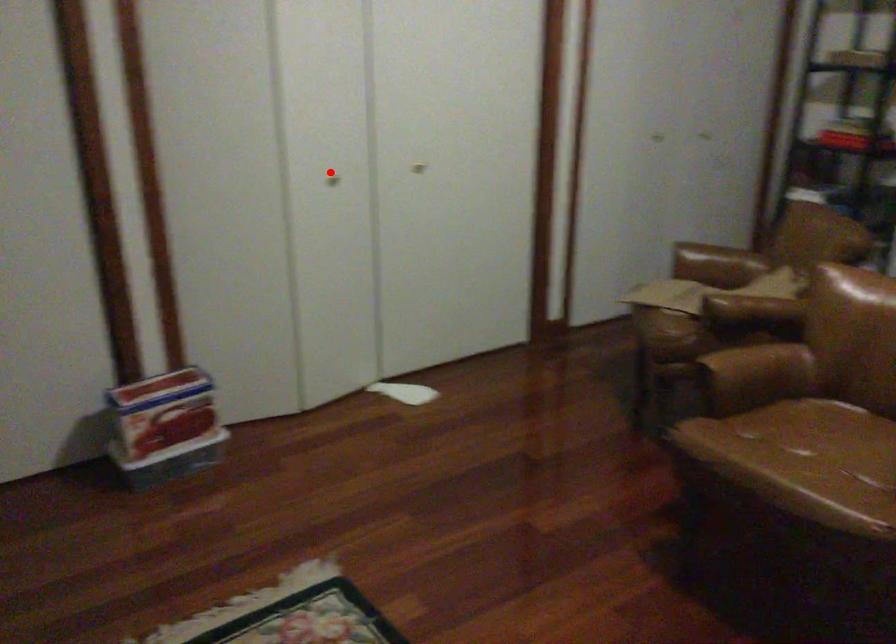
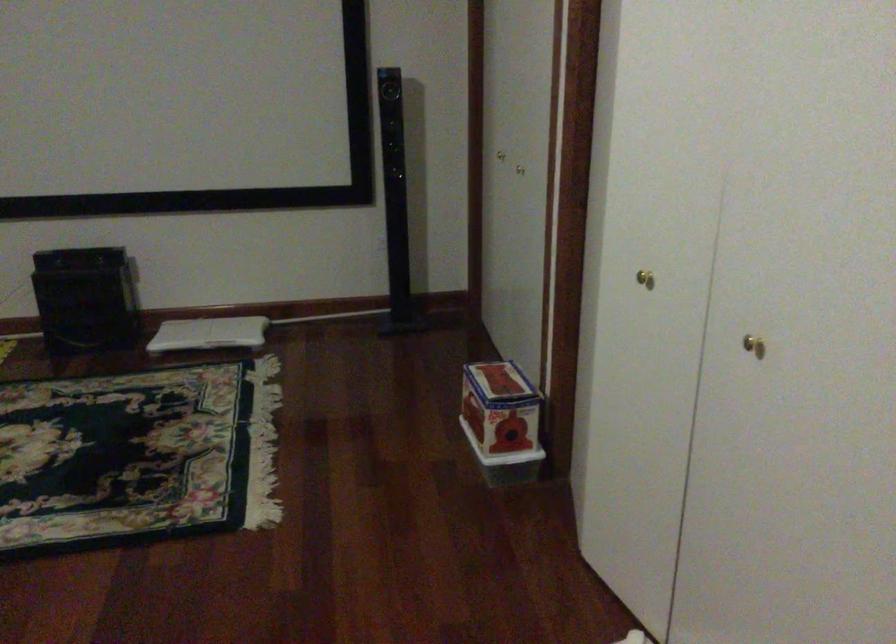
Question: I am providing you with two images of the same scene from different viewpoints. In image1, a red point is highlighted. Considering the same 3D point in image2, which of the following is correct?

Choices:
 (A) It is closer
 (B) It is farther

Answer: (A)